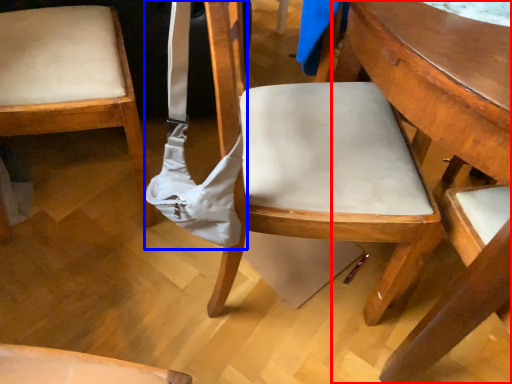
Question: Which object appears closest to the camera in this image, table (highlighted by a red box) or shoulder bag (highlighted by a blue box)?

Choices:
 (A) table
 (B) shoulder bag

Answer: (A)